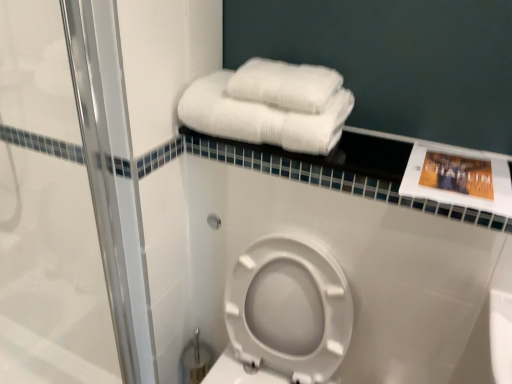
Describe the element at coordinates (285, 85) in the screenshot. I see `white fluffy towels at upper center, which appears as the second towel when ordered from the bottom` at that location.

Measure the distance between clear glass shower door at left and camera.

clear glass shower door at left is 32.00 inches away from camera.

This screenshot has width=512, height=384. In order to click on white plastic toilet at lower center in this screenshot , I will do `click(284, 314)`.

This screenshot has width=512, height=384. I want to click on white fluffy towels at upper center, which ranks as the 1th towel in top-to-bottom order, so click(285, 85).

From the image's perspective, which one is positioned higher, white fluffy towels at upper right, which is counted as the 1th towel, starting from the bottom, or white glossy towel rack at upper center?

white fluffy towels at upper right, which is counted as the 1th towel, starting from the bottom.

Is white fluffy towels at upper right, the 2th towel when ordered from top to bottom, further to the viewer compared to white glossy towel rack at upper center?

Yes, white fluffy towels at upper right, the 2th towel when ordered from top to bottom, is further from the camera.

Starting from the white glossy towel rack at upper center, which towel is the 1st one behind? Please provide its 2D coordinates.

[(261, 117)]

Can you confirm if white fluffy towels at upper right, which is counted as the 1th towel, starting from the bottom, is taller than white glossy towel rack at upper center?

Yes, white fluffy towels at upper right, which is counted as the 1th towel, starting from the bottom, is taller than white glossy towel rack at upper center.

How many degrees apart are the facing directions of white glossy towel rack at upper center and white fluffy towels at upper center, which appears as the second towel when ordered from the bottom?

0.187 degrees separate the facing orientations of white glossy towel rack at upper center and white fluffy towels at upper center, which appears as the second towel when ordered from the bottom.

Which object is wider, white glossy towel rack at upper center or white fluffy towels at upper center, which ranks as the 1th towel in top-to-bottom order?

Wider between the two is white glossy towel rack at upper center.

Can white fluffy towels at upper center, which ranks as the 1th towel in top-to-bottom order, be found inside white glossy towel rack at upper center?

No, white fluffy towels at upper center, which ranks as the 1th towel in top-to-bottom order, is not a part of white glossy towel rack at upper center.

From a real-world perspective, does white glossy towel rack at upper center sit lower than white fluffy towels at upper center, which ranks as the 1th towel in top-to-bottom order?

Yes, from a real-world perspective, white glossy towel rack at upper center is below white fluffy towels at upper center, which ranks as the 1th towel in top-to-bottom order.

Looking at their sizes, would you say white glossy towel rack at upper center is wider or thinner than clear glass shower door at left?

white glossy towel rack at upper center is wider than clear glass shower door at left.

Is white glossy towel rack at upper center to the left of clear glass shower door at left from the viewer's perspective?

Incorrect, white glossy towel rack at upper center is not on the left side of clear glass shower door at left.

Is white glossy towel rack at upper center oriented towards clear glass shower door at left?

No, white glossy towel rack at upper center does not turn towards clear glass shower door at left.

From the image's perspective, relative to clear glass shower door at left, is white glossy towel rack at upper center above or below?

white glossy towel rack at upper center is situated higher than clear glass shower door at left in the image.

Consider the image. Is there a large distance between white glossy towel rack at upper center and white plastic toilet at lower center?

white glossy towel rack at upper center is near white plastic toilet at lower center, not far away.

Is white glossy towel rack at upper center oriented towards white plastic toilet at lower center?

No, white glossy towel rack at upper center is not aimed at white plastic toilet at lower center.

Which of these two, white glossy towel rack at upper center or white plastic toilet at lower center, is thinner?

With smaller width is white glossy towel rack at upper center.

Can you confirm if clear glass shower door at left is shorter than white fluffy towels at upper center, which appears as the second towel when ordered from the bottom?

No, clear glass shower door at left is not shorter than white fluffy towels at upper center, which appears as the second towel when ordered from the bottom.

Considering the relative positions of clear glass shower door at left and white fluffy towels at upper center, which appears as the second towel when ordered from the bottom, in the image provided, is clear glass shower door at left to the left of white fluffy towels at upper center, which appears as the second towel when ordered from the bottom, from the viewer's perspective?

Indeed, clear glass shower door at left is positioned on the left side of white fluffy towels at upper center, which appears as the second towel when ordered from the bottom.

Could you tell me if clear glass shower door at left is facing white fluffy towels at upper center, which appears as the second towel when ordered from the bottom?

No.

Are clear glass shower door at left and white fluffy towels at upper center, which appears as the second towel when ordered from the bottom, beside each other?

No, clear glass shower door at left is not with white fluffy towels at upper center, which appears as the second towel when ordered from the bottom.

From the image's perspective, is clear glass shower door at left over white glossy towel rack at upper center?

No.

From the picture: From their relative heights in the image, would you say clear glass shower door at left is taller or shorter than white glossy towel rack at upper center?

clear glass shower door at left is taller than white glossy towel rack at upper center.

Which object is thinner, clear glass shower door at left or white glossy towel rack at upper center?

With smaller width is clear glass shower door at left.

Is white fluffy towels at upper right, the 2th towel when ordered from top to bottom, taller or shorter than clear glass shower door at left?

In the image, white fluffy towels at upper right, the 2th towel when ordered from top to bottom, appears to be shorter than clear glass shower door at left.

Is white fluffy towels at upper right, which is counted as the 1th towel, starting from the bottom, situated inside clear glass shower door at left or outside?

white fluffy towels at upper right, which is counted as the 1th towel, starting from the bottom, is not enclosed by clear glass shower door at left.

At what (x,y) coordinates should I click in order to perform the action: click on towel that is the 1st one when counting backward from the clear glass shower door at left. Please return your answer as a coordinate pair (x, y). This screenshot has width=512, height=384. Looking at the image, I should click on tap(261, 117).

Is white fluffy towels at upper right, the 2th towel when ordered from top to bottom, facing away from clear glass shower door at left?

white fluffy towels at upper right, the 2th towel when ordered from top to bottom, does not have its back to clear glass shower door at left.

Where is `the 2nd towel to the left of the white glossy towel rack at upper center, counting from the anchor's position`? Image resolution: width=512 pixels, height=384 pixels. the 2nd towel to the left of the white glossy towel rack at upper center, counting from the anchor's position is located at coordinates (261, 117).

At what (x,y) coordinates should I click in order to perform the action: click on balustrade to the right of white fluffy towels at upper center, which ranks as the 1th towel in top-to-bottom order. Please return your answer as a coordinate pair (x, y). This screenshot has width=512, height=384. Looking at the image, I should click on (340, 170).

When comparing their distances from white glossy towel rack at upper center, does white plastic toilet at lower center or white fluffy towels at upper right, the 2th towel when ordered from top to bottom, seem closer?

white fluffy towels at upper right, the 2th towel when ordered from top to bottom, is closer to white glossy towel rack at upper center.

Estimate the real-world distances between objects in this image. Which object is further from white plastic toilet at lower center, white fluffy towels at upper right, the 2th towel when ordered from top to bottom, or white fluffy towels at upper center, which appears as the second towel when ordered from the bottom?

Among the two, white fluffy towels at upper center, which appears as the second towel when ordered from the bottom, is located further to white plastic toilet at lower center.

Based on their spatial positions, is white plastic toilet at lower center or white fluffy towels at upper center, which appears as the second towel when ordered from the bottom, closer to white fluffy towels at upper right, which is counted as the 1th towel, starting from the bottom?

The object closer to white fluffy towels at upper right, which is counted as the 1th towel, starting from the bottom, is white fluffy towels at upper center, which appears as the second towel when ordered from the bottom.

Which object lies nearer to the anchor point white fluffy towels at upper center, which appears as the second towel when ordered from the bottom, white glossy towel rack at upper center or white fluffy towels at upper right, the 2th towel when ordered from top to bottom?

white fluffy towels at upper right, the 2th towel when ordered from top to bottom, lies closer to white fluffy towels at upper center, which appears as the second towel when ordered from the bottom, than the other object.

From the image, which object appears to be farther from white fluffy towels at upper center, which appears as the second towel when ordered from the bottom, clear glass shower door at left or white glossy towel rack at upper center?

Among the two, clear glass shower door at left is located further to white fluffy towels at upper center, which appears as the second towel when ordered from the bottom.

Estimate the real-world distances between objects in this image. Which object is closer to white fluffy towels at upper right, which is counted as the 1th towel, starting from the bottom, white fluffy towels at upper center, which appears as the second towel when ordered from the bottom, or white glossy towel rack at upper center?

white fluffy towels at upper center, which appears as the second towel when ordered from the bottom.

From the image, which object appears to be farther from clear glass shower door at left, white plastic toilet at lower center or white fluffy towels at upper center, which ranks as the 1th towel in top-to-bottom order?

white fluffy towels at upper center, which ranks as the 1th towel in top-to-bottom order.

When comparing their distances from clear glass shower door at left, does white fluffy towels at upper right, the 2th towel when ordered from top to bottom, or white plastic toilet at lower center seem closer?

Among the two, white plastic toilet at lower center is located nearer to clear glass shower door at left.

Where is `balustrade between white fluffy towels at upper right, which is counted as the 1th towel, starting from the bottom, and white plastic toilet at lower center vertically`? balustrade between white fluffy towels at upper right, which is counted as the 1th towel, starting from the bottom, and white plastic toilet at lower center vertically is located at coordinates (340, 170).

Locate an element on the screen. This screenshot has width=512, height=384. towel between clear glass shower door at left and white fluffy towels at upper center, which appears as the second towel when ordered from the bottom is located at coordinates (261, 117).

You are a GUI agent. You are given a task and a screenshot of the screen. Output one action in this format:
    pyautogui.click(x=<x>, y=<y>)
    Task: Click on the towel that lies between white fluffy towels at upper center, which ranks as the 1th towel in top-to-bottom order, and white plastic toilet at lower center from top to bottom
    
    Given the screenshot: What is the action you would take?
    pyautogui.click(x=261, y=117)

This screenshot has height=384, width=512. Find the location of `shower door that lies between white fluffy towels at upper center, which appears as the second towel when ordered from the bottom, and white plastic toilet at lower center from top to bottom`. shower door that lies between white fluffy towels at upper center, which appears as the second towel when ordered from the bottom, and white plastic toilet at lower center from top to bottom is located at coordinates (79, 195).